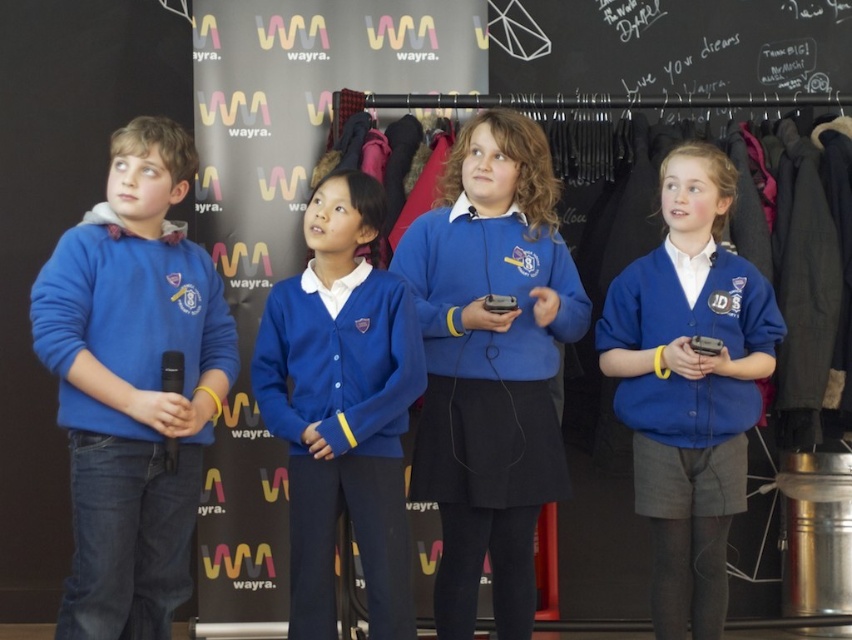
Question: Can you confirm if blue fabric uniform at center is positioned below blue cardigan at center?

Choices:
 (A) yes
 (B) no

Answer: (A)

Question: Which object is the farthest from the blue fabric uniform at center?

Choices:
 (A) matte blue hoodie at left
 (B) matte blue sweater at center
 (C) blue cardigan at center

Answer: (A)

Question: Among these points, which one is nearest to the camera?

Choices:
 (A) (645, 276)
 (B) (335, 528)

Answer: (B)

Question: Is matte blue sweater at center to the left of blue cardigan at center from the viewer's perspective?

Choices:
 (A) no
 (B) yes

Answer: (A)

Question: Which object is farther from the camera taking this photo?

Choices:
 (A) matte blue sweater at center
 (B) blue cardigan at center
 (C) matte blue hoodie at left

Answer: (A)

Question: Where is matte blue sweater at center located in relation to blue cardigan at center in the image?

Choices:
 (A) left
 (B) right

Answer: (B)